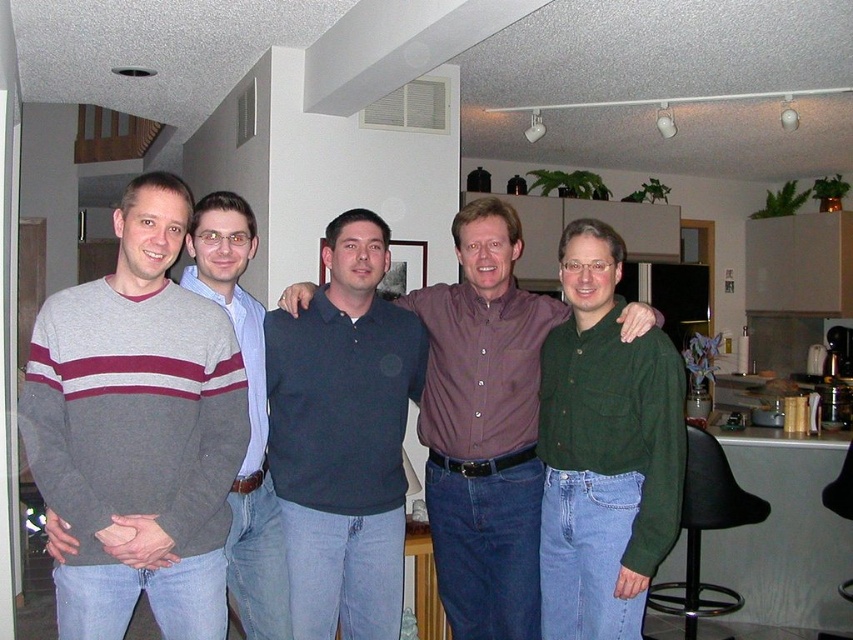
You are taking a photo of the group of men in the scene. You want to focus on the point at (x=498, y=432) and the point at (x=715, y=604). Which point should you focus on first if you want to ensure both points are in sharp focus?

You should focus on the point at (x=498, y=432) first because it is closer to the camera than the point at (x=715, y=604). By focusing on the closer point, the farther point will also be within the depth of field and appear sharp.

You are a photographer standing in the kitchen area. You want to take a photo of the gray striped sweater at left and the green cotton shirt at center. How far apart are these two items?

The gray striped sweater at left is 37.72 inches away from the green cotton shirt at center.

You are a photographer setting up for a group photo. You notice the dark blue shirt at center and the black plastic stool at lower right. Which object is located to the right of the other?

The dark blue shirt at center is positioned on the left side of black plastic stool at lower right, so the black plastic stool at lower right is to the right of the dark blue shirt at center.